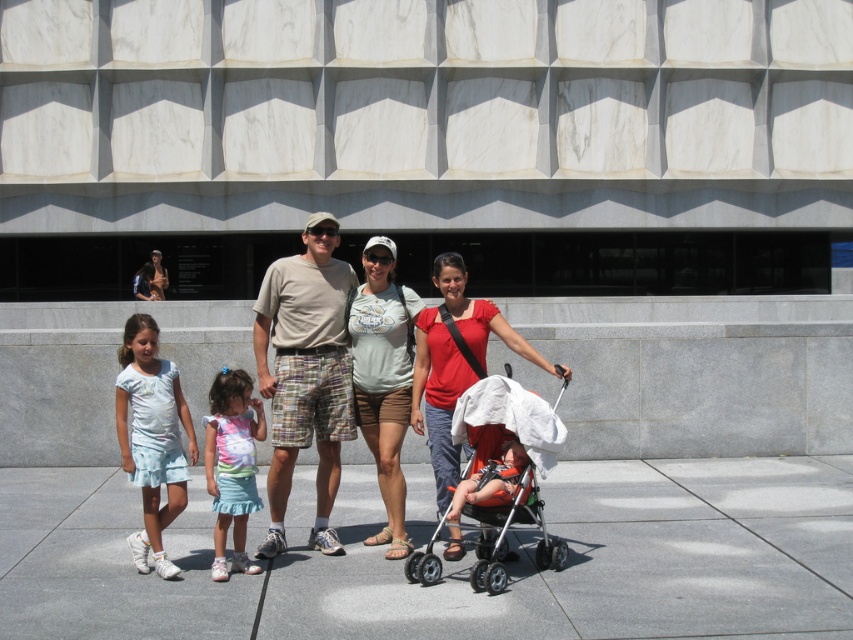
You need to place the matte white stroller at center on the gray concrete pavement at center. Based on the scene description, can the stroller fit on the pavement?

The gray concrete pavement at center might be wider than matte white stroller at center, so it is possible that the stroller can fit on the pavement.